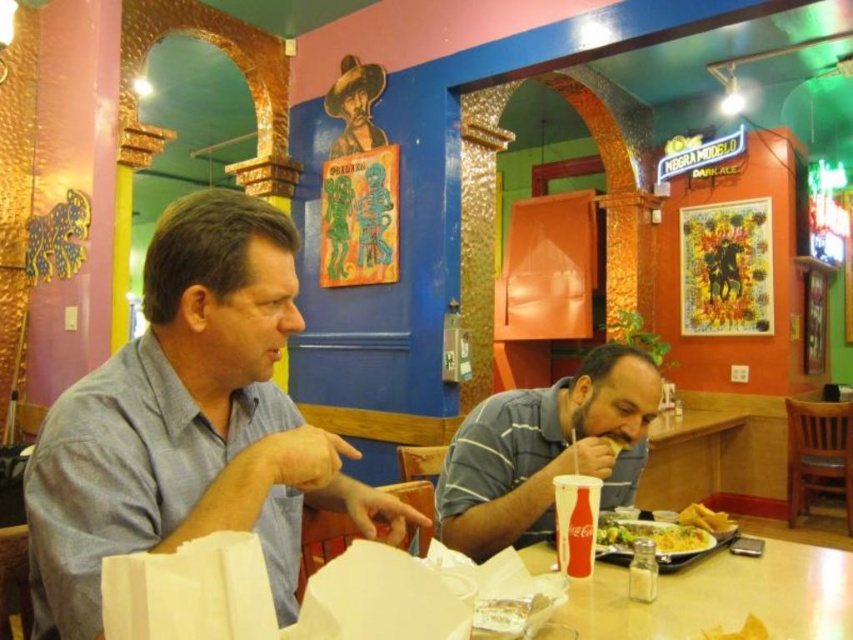
Question: Does plastic disposable plate at center appear on the left side of yellow tortilla chips at lower right?

Choices:
 (A) no
 (B) yes

Answer: (B)

Question: From the image, what is the correct spatial relationship of white paper cup at lower center in relation to yellow matte tortilla at lower center?

Choices:
 (A) right
 (B) left

Answer: (B)

Question: Which point appears farthest from the camera in this image?

Choices:
 (A) (648, 536)
 (B) (604, 436)

Answer: (B)

Question: Can you confirm if gray striped shirt at lower right is positioned to the left of white paper cup at lower center?

Choices:
 (A) no
 (B) yes

Answer: (A)

Question: Which point is closer to the camera?

Choices:
 (A) (622, 449)
 (B) (706, 532)
 (C) (572, 513)

Answer: (C)

Question: Which point is closer to the camera taking this photo?

Choices:
 (A) (625, 541)
 (B) (621, 444)
 (C) (560, 438)

Answer: (A)